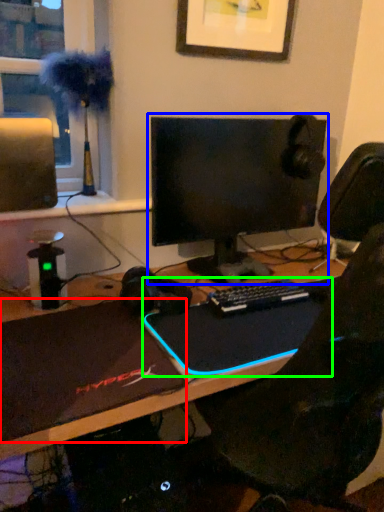
Question: Which is farther away from laptop (highlighted by a red box)? computer monitor (highlighted by a blue box) or laptop (highlighted by a green box)?

Choices:
 (A) computer monitor
 (B) laptop

Answer: (A)